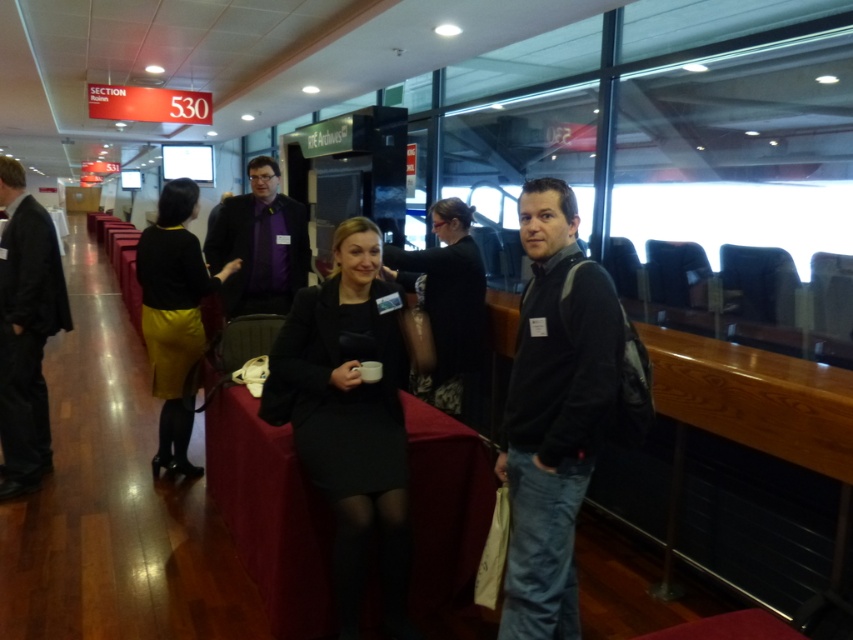
Is matte black sweater at center wider than black dress at center?

Indeed, matte black sweater at center has a greater width compared to black dress at center.

Between matte black sweater at center and black dress at center, which one is positioned higher?

black dress at center is above.

Find the location of a particular element. This screenshot has height=640, width=853. matte black sweater at center is located at coordinates (173, 316).

At what (x,y) coordinates should I click in order to perform the action: click on matte black sweater at center. Please return your answer as a coordinate pair (x, y). Looking at the image, I should click on (173, 316).

Does smooth black table at center have a greater width compared to matte black sweater at center?

Indeed, smooth black table at center has a greater width compared to matte black sweater at center.

Is point (231, 388) less distant than point (198, 305)?

Yes.

You are a GUI agent. You are given a task and a screenshot of the screen. Output one action in this format:
    pyautogui.click(x=<x>, y=<y>)
    Task: Click on the smooth black table at center
    This screenshot has height=640, width=853.
    Given the screenshot: What is the action you would take?
    pyautogui.click(x=271, y=515)

Does smooth black table at center have a lesser width compared to black suit at left?

No.

This screenshot has width=853, height=640. What do you see at coordinates (271, 515) in the screenshot?
I see `smooth black table at center` at bounding box center [271, 515].

The image size is (853, 640). I want to click on smooth black table at center, so click(271, 515).